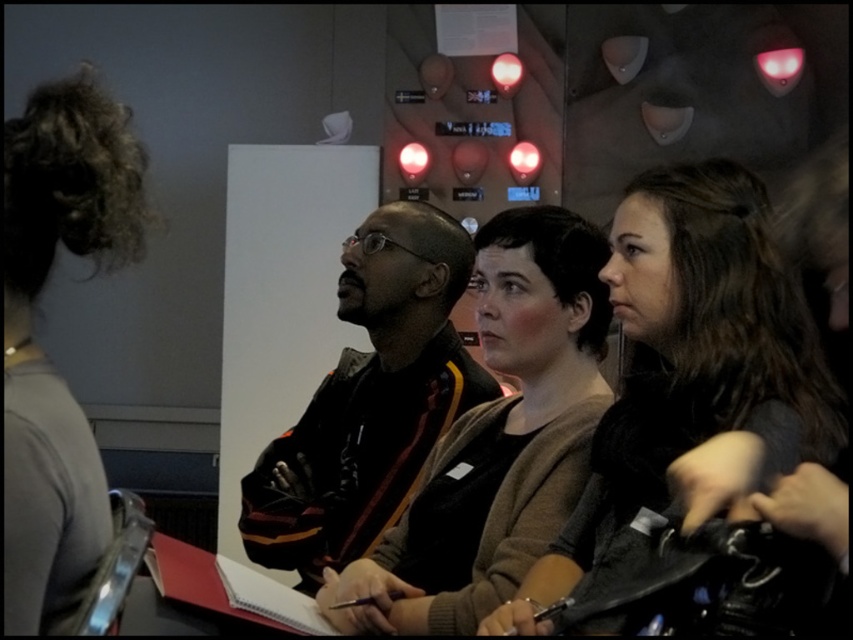
In the conference room scene, you need to determine if the dark brown hair at center is smaller in size compared to the dark brown leather jacket at center. Based on the spatial information provided, can you confirm this?

Yes, the dark brown hair at center occupies less space than the dark brown leather jacket at center, indicating it is smaller in size.

You are standing in the conference room and want to move from point A to point B. Point A is at coordinates point [631,449] and point B is at coordinates point [556,374]. Which point is closer to the front of the room?

Point [631,449] is in front of point [556,374], so point A is closer to the front of the room.

You are organizing a photo shoot and need to ensure that the dark brown hair at center and the dark brown leather jacket at center are both visible in the final image. Based on their positions, which one is closer to the camera?

The dark brown hair at center is in front of the dark brown leather jacket at center, so the dark brown hair at center is closer to the camera.